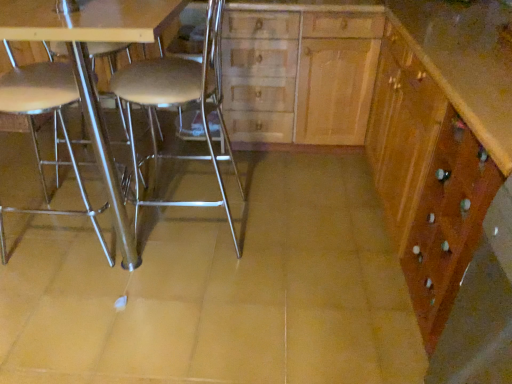
This screenshot has height=384, width=512. Find the location of `space that is in front of metallic silver stool at center, the first chair from the right`. space that is in front of metallic silver stool at center, the first chair from the right is located at coordinates (187, 295).